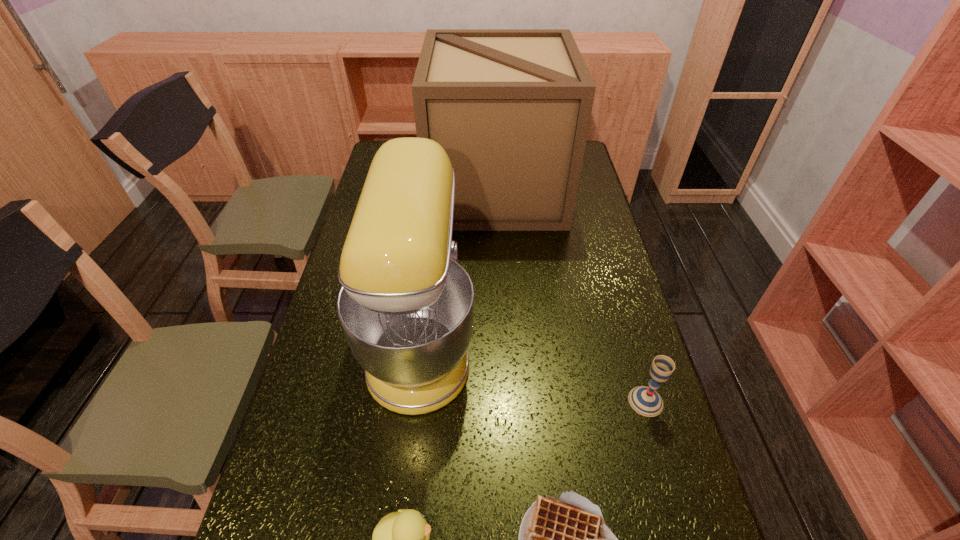
Where is `box`? box is located at coordinates (511, 108).

The width and height of the screenshot is (960, 540). What are the coordinates of `mixer` in the screenshot? It's located at (406, 306).

Locate an element on the screen. chalice is located at coordinates (646, 401).

Find the location of a particular element. The height and width of the screenshot is (540, 960). the rightmost object is located at coordinates (646, 401).

I want to click on free space located on the reinforced sides of the box, so click(x=391, y=190).

The width and height of the screenshot is (960, 540). Identify the location of free space located on the reinforced sides of the box. (414, 190).

This screenshot has width=960, height=540. Identify the location of free space located on the reinforced sides of the box. (378, 190).

Find the location of a particular element. This screenshot has height=540, width=960. vacant space located on the side of the mixer with the control knob is located at coordinates (577, 336).

This screenshot has height=540, width=960. What are the coordinates of `vacant space situated on the back of the rightmost object` in the screenshot? It's located at tap(611, 281).

The height and width of the screenshot is (540, 960). In order to click on object positioned at the far edge in this screenshot , I will do `click(511, 108)`.